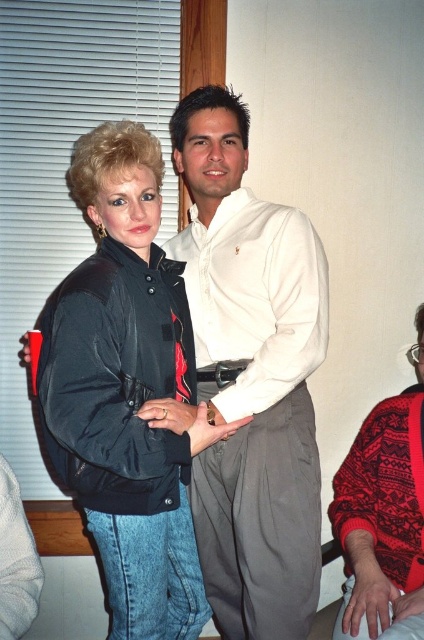
Which is above, white smooth shirt at center or red knitted sweater at lower right?

white smooth shirt at center is above.

Who is more distant from viewer, (240, 291) or (351, 513)?

Positioned behind is point (351, 513).

Image resolution: width=424 pixels, height=640 pixels. I want to click on white smooth shirt at center, so click(251, 378).

You are a GUI agent. You are given a task and a screenshot of the screen. Output one action in this format:
    pyautogui.click(x=<x>, y=<y>)
    Task: Click on the white smooth shirt at center
    The image size is (424, 640).
    Given the screenshot: What is the action you would take?
    pyautogui.click(x=251, y=378)

Is black leather jacket at center below red knitted sweater at lower right?

Actually, black leather jacket at center is above red knitted sweater at lower right.

Does black leather jacket at center have a greater height compared to red knitted sweater at lower right?

Indeed, black leather jacket at center has a greater height compared to red knitted sweater at lower right.

Find the location of `black leather jacket at center`. black leather jacket at center is located at coordinates (128, 394).

Between white smooth shirt at center and black leather jacket at center, which one is positioned higher?

white smooth shirt at center is above.

Does white smooth shirt at center appear on the left side of black leather jacket at center?

No, white smooth shirt at center is not to the left of black leather jacket at center.

This screenshot has height=640, width=424. In order to click on white smooth shirt at center in this screenshot , I will do `click(251, 378)`.